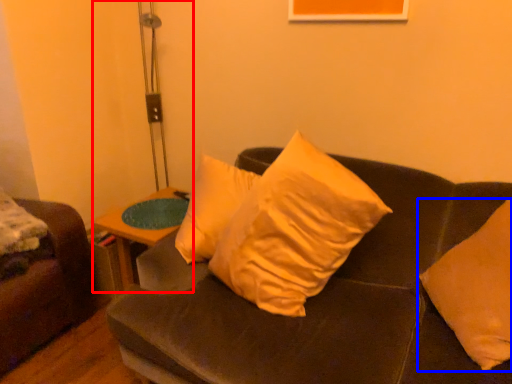
Question: Among these objects, which one is farthest to the camera, table lamp (highlighted by a red box) or pillow (highlighted by a blue box)?

Choices:
 (A) table lamp
 (B) pillow

Answer: (A)